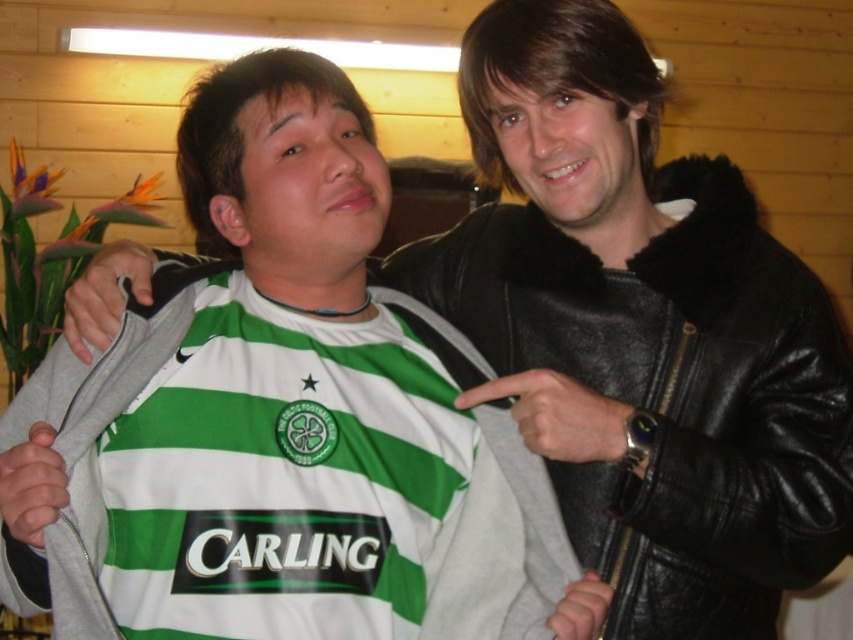
Between point (439, 301) and point (526, 563), which one is positioned behind?

Positioned behind is point (439, 301).

Which of these two, black leather jacket at right or gray fleece jacket at center, stands shorter?

gray fleece jacket at center

Which is in front, point (688, 296) or point (140, 312)?

Point (140, 312)

At what (x,y) coordinates should I click in order to perform the action: click on black leather jacket at right. Please return your answer as a coordinate pair (x, y). The height and width of the screenshot is (640, 853). Looking at the image, I should click on (672, 396).